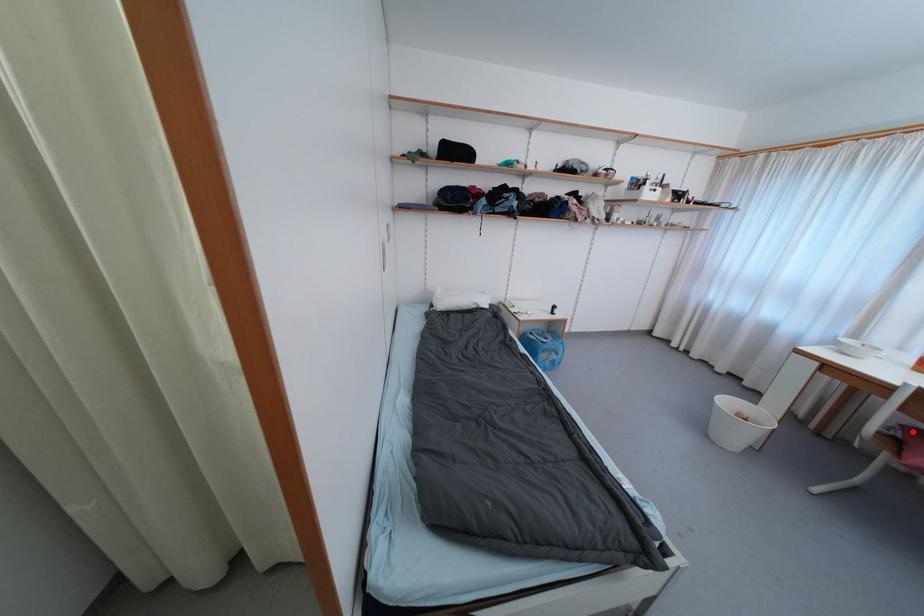
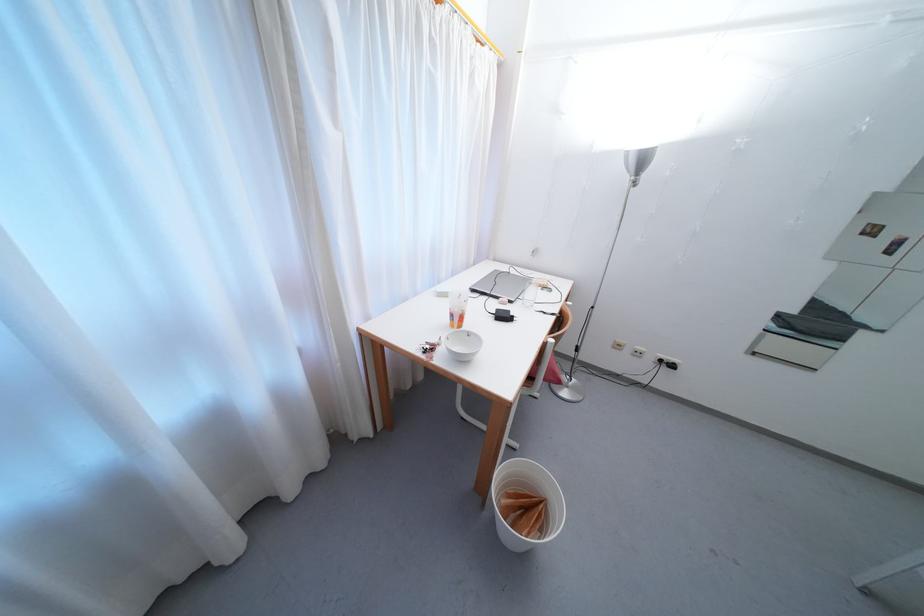
Question: I am providing you with two images of the same scene from different viewpoints. A red point is marked on the first image. At the location where the point appears in image 1, is it still visible in image 2?

Choices:
 (A) Yes
 (B) No

Answer: (B)